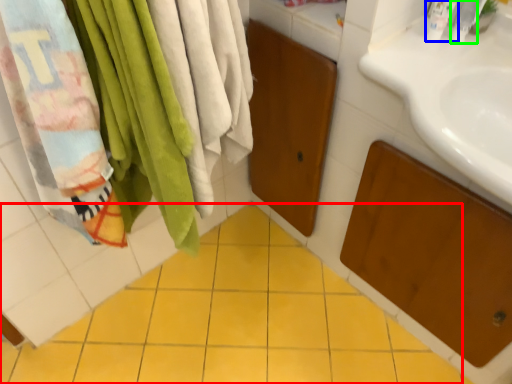
Question: Estimate the real-world distances between objects in this image. Which object is farther from ceramic tile (highlighted by a red box), toiletry (highlighted by a blue box) or toiletry (highlighted by a green box)?

Choices:
 (A) toiletry
 (B) toiletry

Answer: (B)